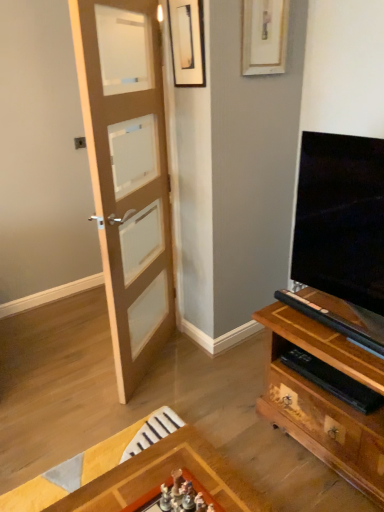
Locate an element on the screen. This screenshot has height=512, width=384. vacant area that is situated to the right of light brown wooden door at left is located at coordinates (206, 368).